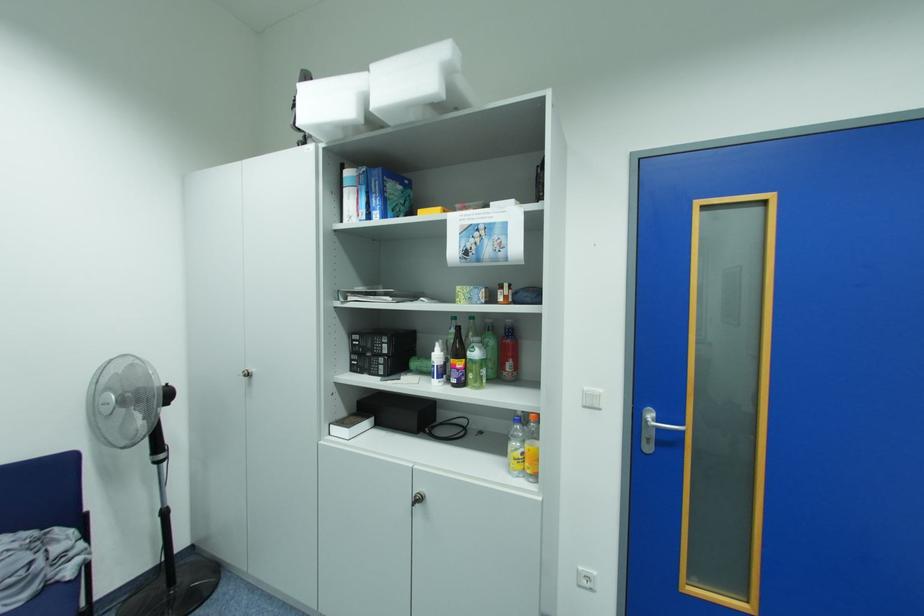
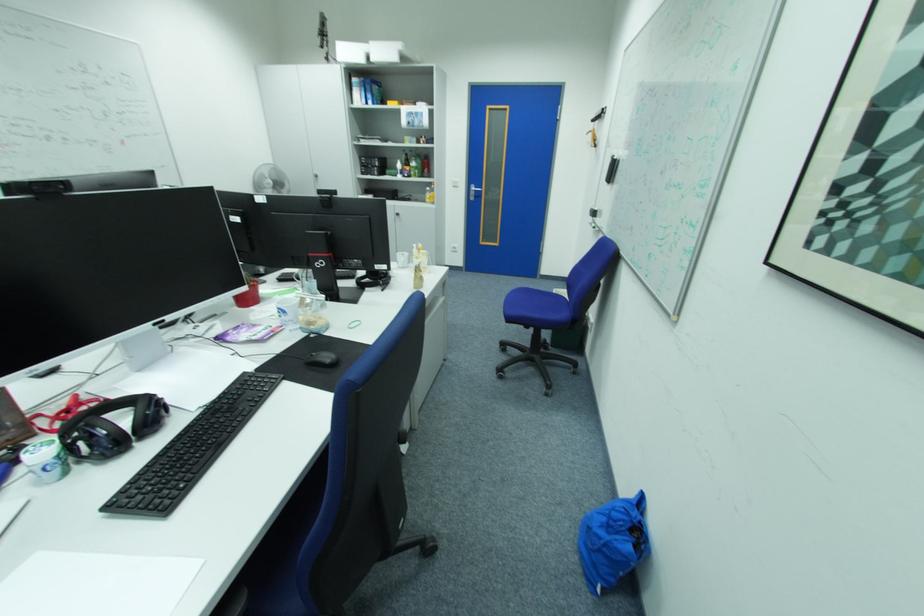
Question: In a continuous first-person perspective shot, in which direction is the camera moving?

Choices:
 (A) Left
 (B) Right
 (C) Forward
 (D) Backward

Answer: (D)